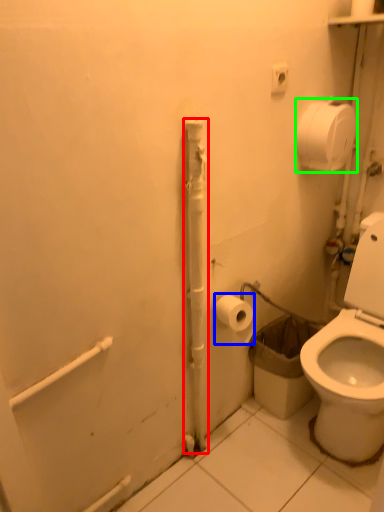
Question: Which object is positioned closest to pipe (highlighted by a red box)? Select from toilet paper (highlighted by a blue box) and toilet paper (highlighted by a green box).

Choices:
 (A) toilet paper
 (B) toilet paper

Answer: (A)